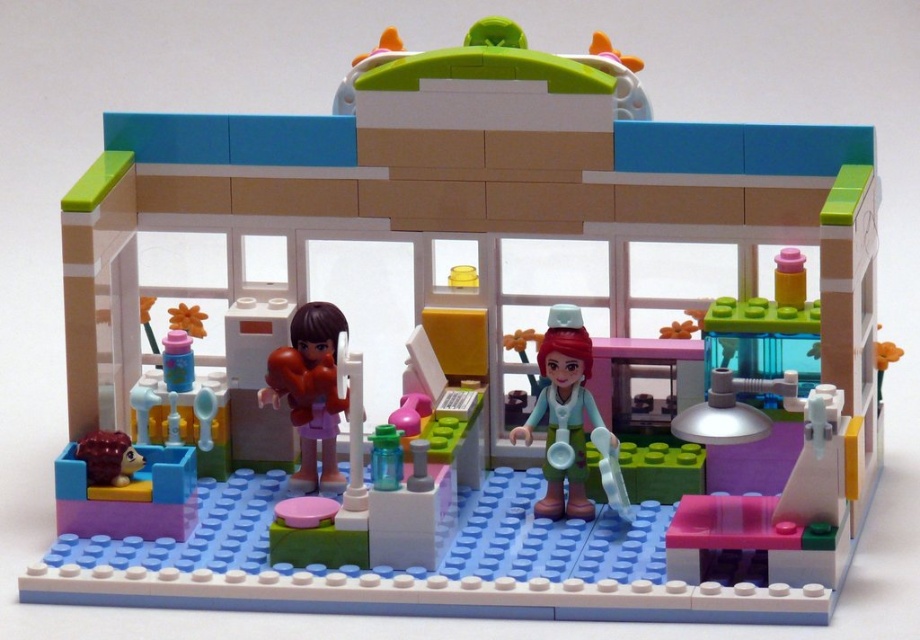
Does smooth teal shirt at center appear on the right side of matte brown hair at center?

Yes, smooth teal shirt at center is to the right of matte brown hair at center.

Is smooth teal shirt at center above matte brown hair at center?

No, smooth teal shirt at center is not above matte brown hair at center.

Identify the location of smooth teal shirt at center. (562, 412).